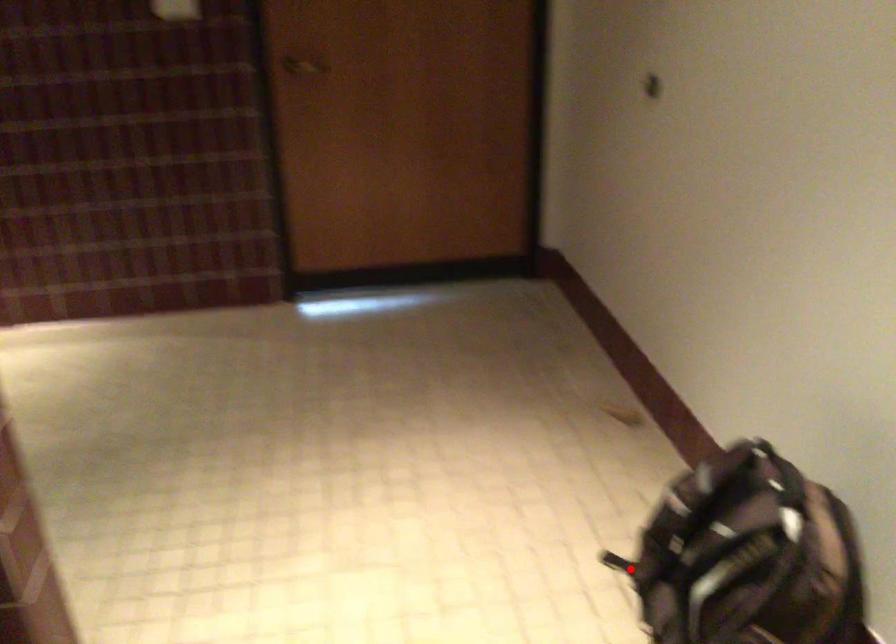
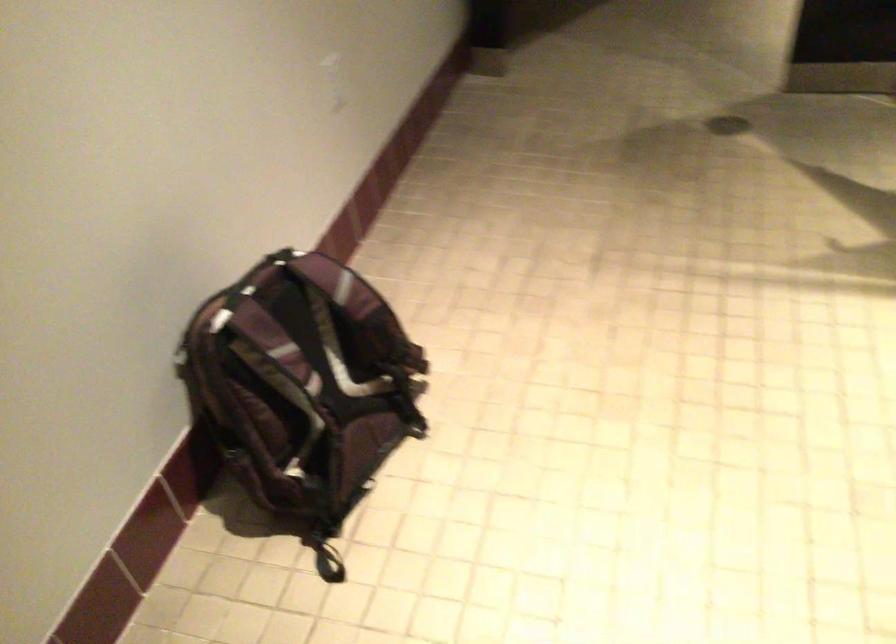
Locate, in the second image, the point that corresponds to the highlighted location in the first image.

(328, 567)